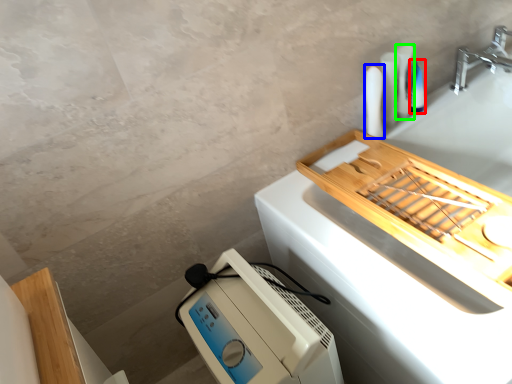
Question: Which object is positioned closest to toiletry (highlighted by a red box)? Select from toiletry (highlighted by a blue box) and toiletry (highlighted by a green box).

Choices:
 (A) toiletry
 (B) toiletry

Answer: (B)